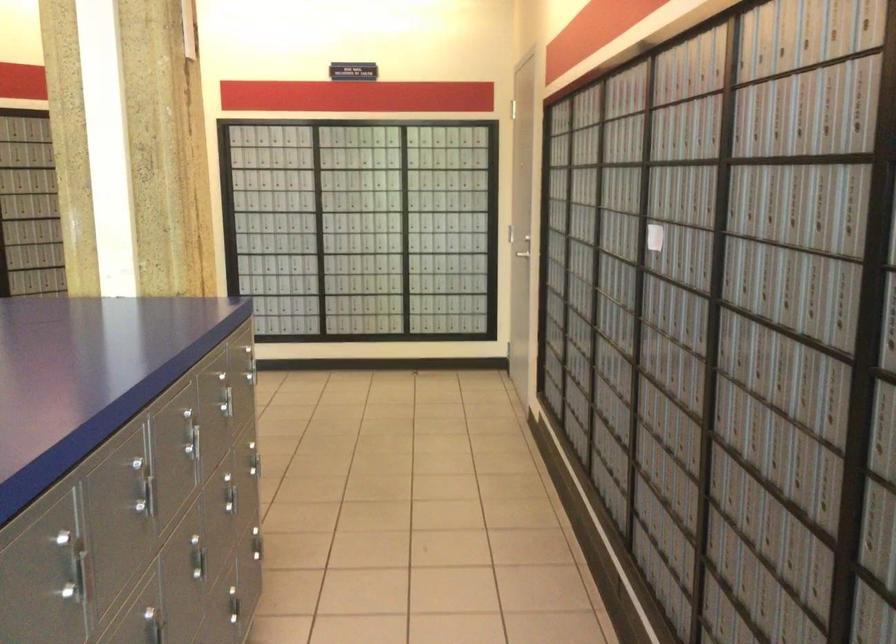
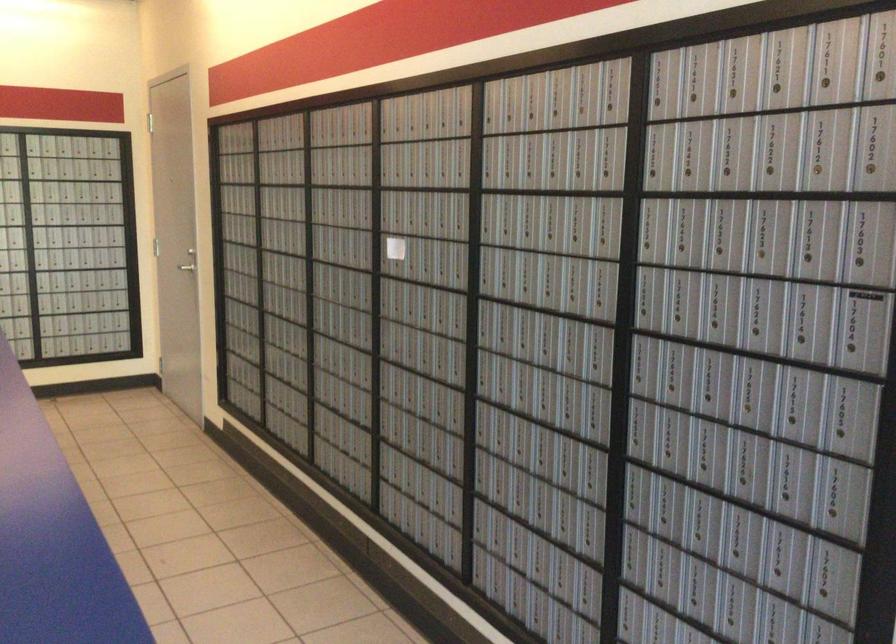
The point at (650, 232) is marked in the first image. Where is the corresponding point in the second image?

(394, 248)